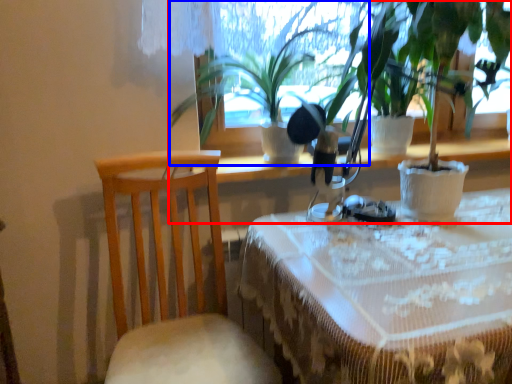
Question: Among these objects, which one is nearest to the camera, houseplant (highlighted by a red box) or houseplant (highlighted by a blue box)?

Choices:
 (A) houseplant
 (B) houseplant

Answer: (A)